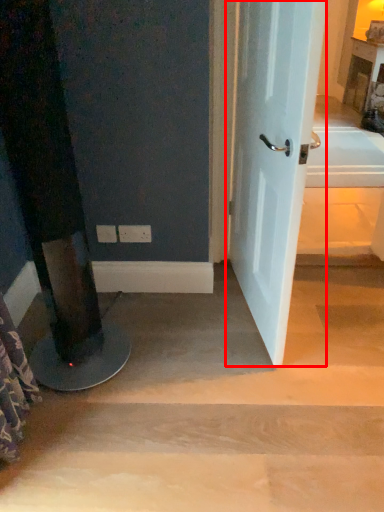
Question: From the image, what is the correct spatial relationship of door (annotated by the red box) in relation to stairwell?

Choices:
 (A) right
 (B) left

Answer: (A)